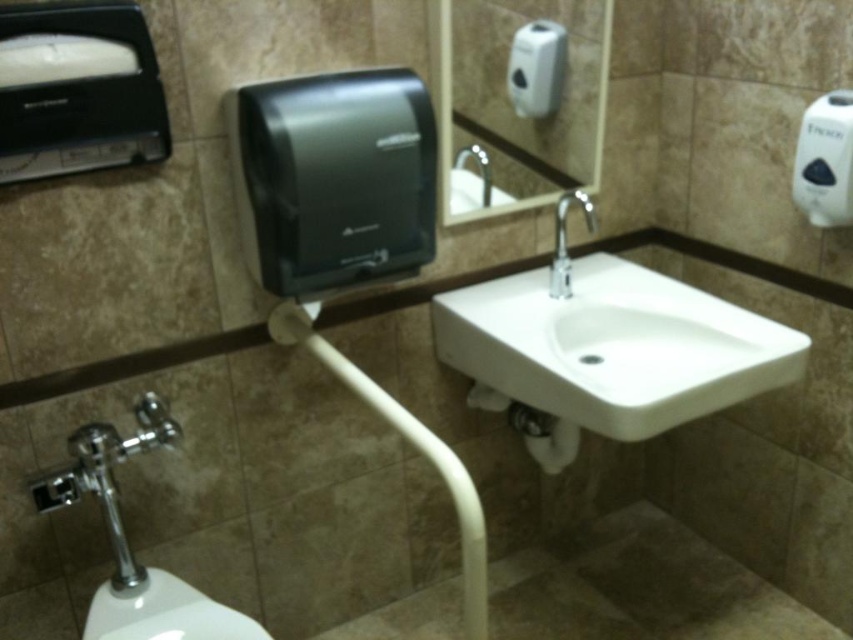
You are a maintenance worker checking the restroom facilities. You need to replace the silver metallic faucet at center. Before doing so, you must ensure there is an alternative hand drying option available. Is the white plastic hand dryer at upper center positioned in a way that users can access it while the faucet is being replaced?

The white plastic hand dryer at upper center is located above the silver metallic faucet at center, so users can still access the hand dryer while the faucet is being replaced since it is positioned higher up and not obstructed by the faucet area.

You are standing in the restroom and need to wash your hands. The white glossy sink at center and the matte silver faucet at upper center are in front of you. Which one should you use to turn on the water?

The matte silver faucet at upper center is used to turn on the water, as it is the faucet controlling the flow from the white glossy sink at center.

You are standing in the restroom and want to wash your hands. The sink is located at point (x=109, y=579). If you are currently 3 feet away from the sink, how much farther do you need to walk to reach it?

The distance between point (x=109, y=579) and the camera is 5.41 feet. Since you are already 3 feet away from the sink, you need to walk an additional 2.41 feet to reach it.